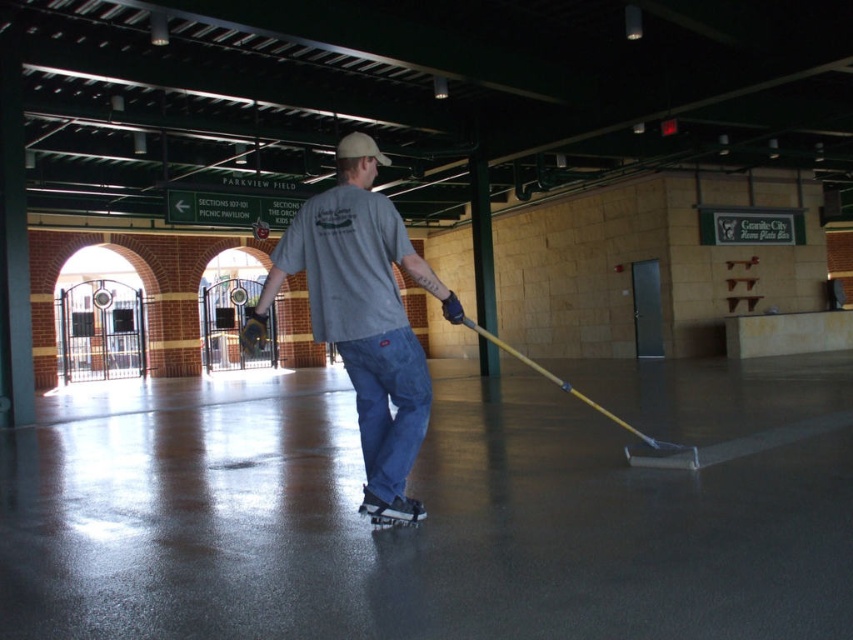
You are a visitor at the ice rink and want to take a photo of the black rubber roller skate at center without including the person in the denim pants at center. Is it possible to adjust your position to achieve this?

The denim pants at center is in front of the black rubber roller skate at center, so you can move to the side to position yourself so that the denim pants at center is no longer blocking the view of the black rubber roller skate at center.

You are standing at the entrance of the indoor ice rink and see the denim pants at center and the black rubber roller skate at center. Which object is closer to your left side?

The denim pants at center is positioned on the left side of the black rubber roller skate at center, so the denim pants at center is closer to your left side.